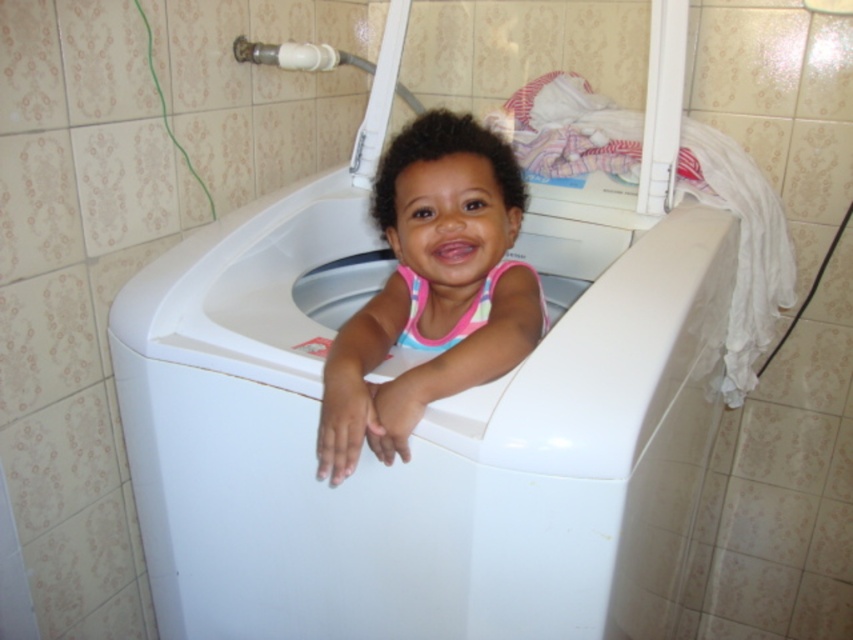
Question: Can you confirm if white plastic bathtub at center is wider than pink fabric at center?

Choices:
 (A) no
 (B) yes

Answer: (B)

Question: Does white plastic bathtub at center have a greater width compared to pink fabric at center?

Choices:
 (A) no
 (B) yes

Answer: (B)

Question: Which of the following is the farthest from the observer?

Choices:
 (A) white plastic bathtub at center
 (B) pink fabric at center

Answer: (B)

Question: Which of the following is the closest to the observer?

Choices:
 (A) (509, 451)
 (B) (474, 234)

Answer: (A)

Question: Does white plastic bathtub at center have a greater width compared to pink fabric at center?

Choices:
 (A) yes
 (B) no

Answer: (A)